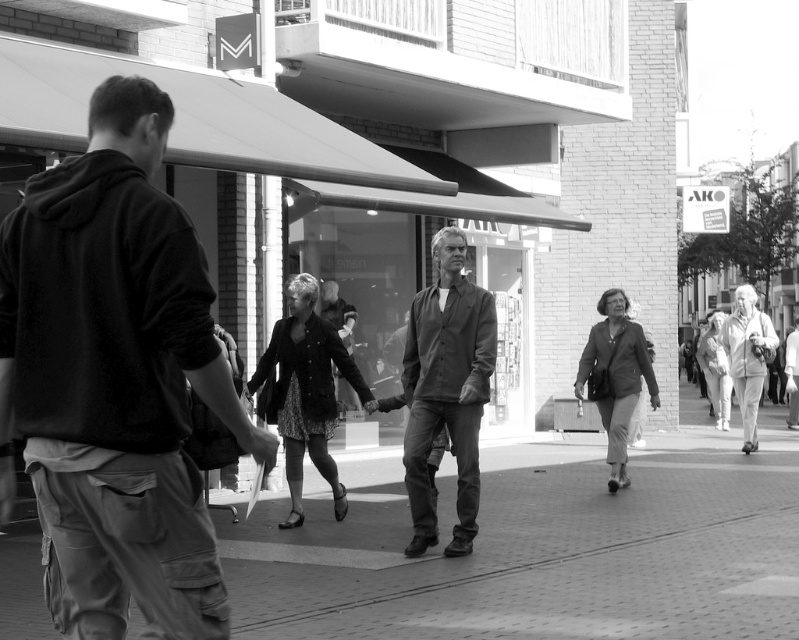
Question: Observing the image, what is the correct spatial positioning of brick pavement at center in reference to dark gray textured shirt at center?

Choices:
 (A) below
 (B) above

Answer: (A)

Question: Which is farther from the dark gray textured shirt at center?

Choices:
 (A) dark gray hoodie at left
 (B) brick pavement at center

Answer: (A)

Question: Considering the real-world distances, which object is farthest from the dark gray hoodie at left?

Choices:
 (A) dark gray textured shirt at center
 (B) brick pavement at center

Answer: (A)

Question: Which point is farther to the camera?

Choices:
 (A) dark gray hoodie at left
 (B) dark gray textured shirt at center

Answer: (B)

Question: Can you confirm if brick pavement at center is positioned below dark gray textured shirt at center?

Choices:
 (A) yes
 (B) no

Answer: (A)

Question: Is brick pavement at center closer to camera compared to dark gray hoodie at left?

Choices:
 (A) no
 (B) yes

Answer: (A)